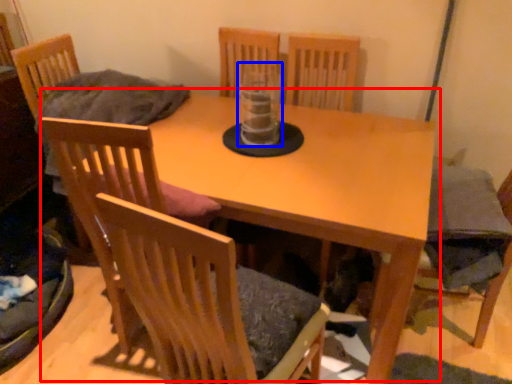
Question: Which of the following is the closest to the observer, table (highlighted by a red box) or glass vase (highlighted by a blue box)?

Choices:
 (A) table
 (B) glass vase

Answer: (A)